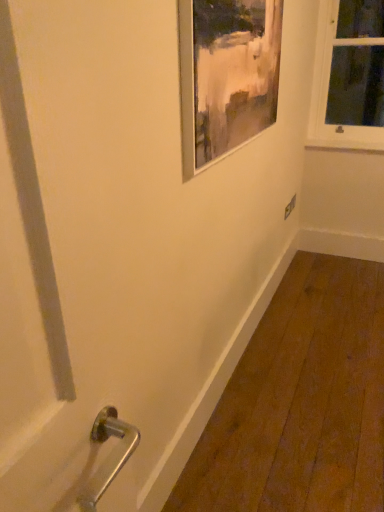
This screenshot has height=512, width=384. Describe the element at coordinates (345, 145) in the screenshot. I see `white matte window sill at upper right` at that location.

What do you see at coordinates (226, 75) in the screenshot? I see `metallic silver picture frame at upper center` at bounding box center [226, 75].

Identify the location of metallic silver picture frame at upper center. This screenshot has width=384, height=512. (226, 75).

The image size is (384, 512). Identify the location of white wooden window at upper right. (349, 76).

In order to face white wooden window at upper right, should I rotate leftwards or rightwards?

To face it directly, rotate right by 21.068 degrees.

At what (x,y) coordinates should I click in order to perform the action: click on white matte window sill at upper right. Please return your answer as a coordinate pair (x, y). This screenshot has height=512, width=384. Looking at the image, I should click on (345, 145).

Is white wooden window at upper right oriented away from metallic silver picture frame at upper center?

No, white wooden window at upper right is not facing the opposite direction of metallic silver picture frame at upper center.

Which object is more forward, white wooden window at upper right or metallic silver picture frame at upper center?

metallic silver picture frame at upper center.

Could you measure the distance between white wooden window at upper right and metallic silver picture frame at upper center?

The distance of white wooden window at upper right from metallic silver picture frame at upper center is 4.88 feet.

Based on the photo, from a real-world perspective, who is located higher, white wooden window at upper right or metallic silver picture frame at upper center?

metallic silver picture frame at upper center.

In the scene shown: Is white matte window sill at upper right bigger than white wooden window at upper right?

Incorrect, white matte window sill at upper right is not larger than white wooden window at upper right.

Does point (340, 146) lie behind point (362, 140)?

Yes, point (340, 146) is farther from viewer.

Which of these two, white matte window sill at upper right or white wooden window at upper right, is thinner?

white matte window sill at upper right is thinner.

From the image's perspective, who appears lower, metallic silver picture frame at upper center or white matte window sill at upper right?

metallic silver picture frame at upper center is shown below in the image.

Could you tell me if metallic silver picture frame at upper center is turned towards white matte window sill at upper right?

No, metallic silver picture frame at upper center is not turned towards white matte window sill at upper right.

Between metallic silver picture frame at upper center and white matte window sill at upper right, which one has more height?

metallic silver picture frame at upper center.

Is metallic silver picture frame at upper center beside white matte window sill at upper right?

No, metallic silver picture frame at upper center is not with white matte window sill at upper right.

Which is in front, white wooden window at upper right or white matte window sill at upper right?

white wooden window at upper right.

From the image's perspective, does white wooden window at upper right appear lower than white matte window sill at upper right?

No, from the image's perspective, white wooden window at upper right is not below white matte window sill at upper right.

Looking at this image, is white wooden window at upper right next to white matte window sill at upper right?

white wooden window at upper right is not next to white matte window sill at upper right, and they're not touching.

Considering the positions of objects white matte window sill at upper right and metallic silver picture frame at upper center in the image provided, who is behind, white matte window sill at upper right or metallic silver picture frame at upper center?

white matte window sill at upper right is behind.

Is metallic silver picture frame at upper center at the back of white matte window sill at upper right?

No, metallic silver picture frame at upper center is not at the back of white matte window sill at upper right.

Considering the sizes of objects white matte window sill at upper right and metallic silver picture frame at upper center in the image provided, who is thinner, white matte window sill at upper right or metallic silver picture frame at upper center?

Thinner between the two is metallic silver picture frame at upper center.

What are the coordinates of `picture frame in front of the white matte window sill at upper right` in the screenshot? It's located at (226, 75).

The image size is (384, 512). What are the coordinates of `window lying behind the metallic silver picture frame at upper center` in the screenshot? It's located at (349, 76).

Is metallic silver picture frame at upper center placed right next to white wooden window at upper right?

There is a gap between metallic silver picture frame at upper center and white wooden window at upper right.

Considering the relative positions of metallic silver picture frame at upper center and white wooden window at upper right in the image provided, is metallic silver picture frame at upper center to the right of white wooden window at upper right from the viewer's perspective?

No, metallic silver picture frame at upper center is not to the right of white wooden window at upper right.

Does metallic silver picture frame at upper center have a greater width compared to white wooden window at upper right?

No, metallic silver picture frame at upper center is not wider than white wooden window at upper right.

Find the location of a particular element. The image size is (384, 512). window on the right of metallic silver picture frame at upper center is located at coordinates (349, 76).

In order to click on window above the white matte window sill at upper right (from a real-world perspective) in this screenshot , I will do `click(349, 76)`.

Considering their positions, is white matte window sill at upper right positioned further to white wooden window at upper right than metallic silver picture frame at upper center?

metallic silver picture frame at upper center.

From the image, which object appears to be farther from white wooden window at upper right, metallic silver picture frame at upper center or white matte window sill at upper right?

metallic silver picture frame at upper center.

Consider the image. Based on their spatial positions, is white wooden window at upper right or metallic silver picture frame at upper center further from white matte window sill at upper right?

metallic silver picture frame at upper center.

Looking at the image, which one is located closer to metallic silver picture frame at upper center, white matte window sill at upper right or white wooden window at upper right?

Among the two, white wooden window at upper right is located nearer to metallic silver picture frame at upper center.

Looking at the image, which one is located further to white matte window sill at upper right, metallic silver picture frame at upper center or white wooden window at upper right?

metallic silver picture frame at upper center.

Looking at the image, which one is located closer to metallic silver picture frame at upper center, white wooden window at upper right or white matte window sill at upper right?

white wooden window at upper right lies closer to metallic silver picture frame at upper center than the other object.

At what (x,y) coordinates should I click in order to perform the action: click on window located between metallic silver picture frame at upper center and white matte window sill at upper right in the depth direction. Please return your answer as a coordinate pair (x, y). This screenshot has height=512, width=384. Looking at the image, I should click on (349, 76).